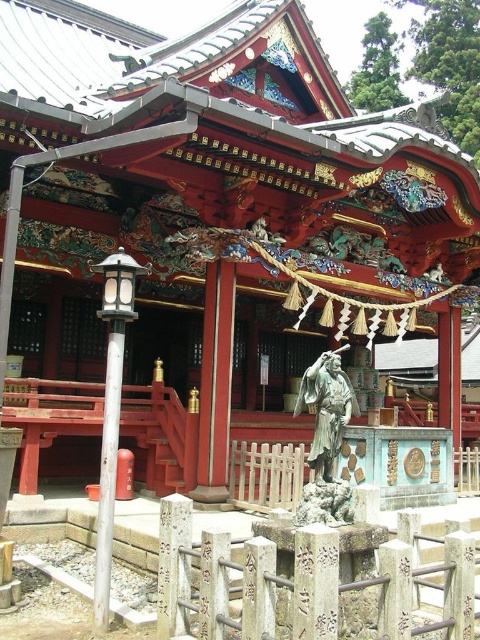
Question: Which point appears closest to the camera in this image?

Choices:
 (A) (326, 381)
 (B) (168, 557)

Answer: (B)

Question: Can you confirm if bronze statue at center is bigger than white stone pillar at center?

Choices:
 (A) yes
 (B) no

Answer: (A)

Question: Is bronze statue at center to the right of white stone pillar at center from the viewer's perspective?

Choices:
 (A) no
 (B) yes

Answer: (B)

Question: Which object is closer to the camera taking this photo?

Choices:
 (A) bronze statue at center
 (B) white stone pillar at center

Answer: (B)

Question: Which point is farther to the camera?

Choices:
 (A) (324, 369)
 (B) (168, 624)

Answer: (A)

Question: Does bronze statue at center appear on the left side of white stone pillar at center?

Choices:
 (A) yes
 (B) no

Answer: (B)